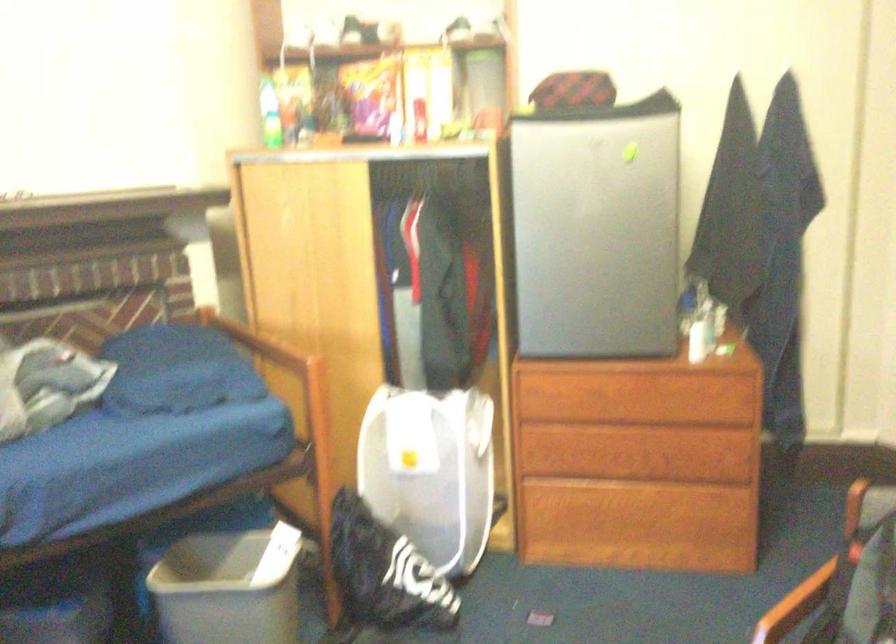
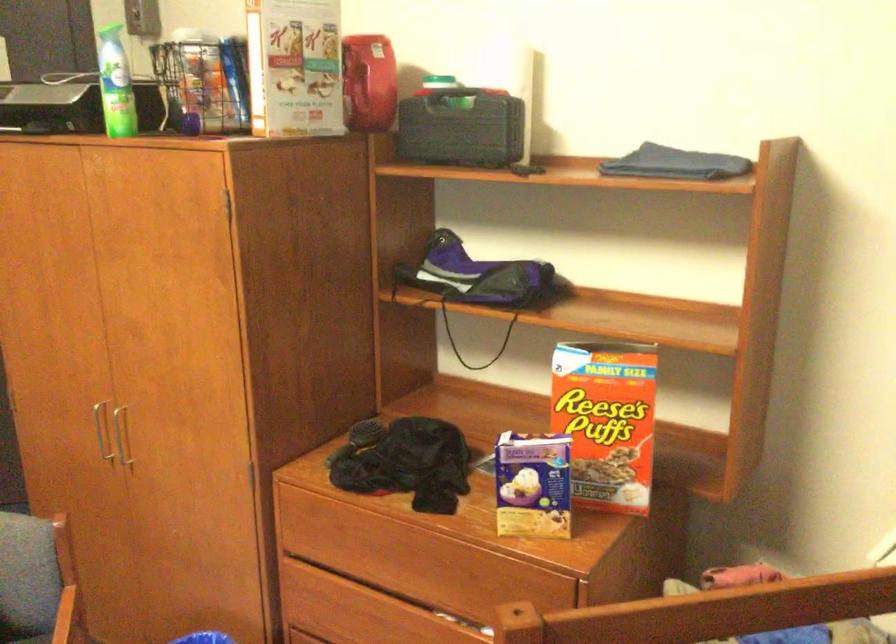
Question: How did the camera likely rotate?

Choices:
 (A) Left
 (B) Right
 (C) Up
 (D) Down

Answer: (B)